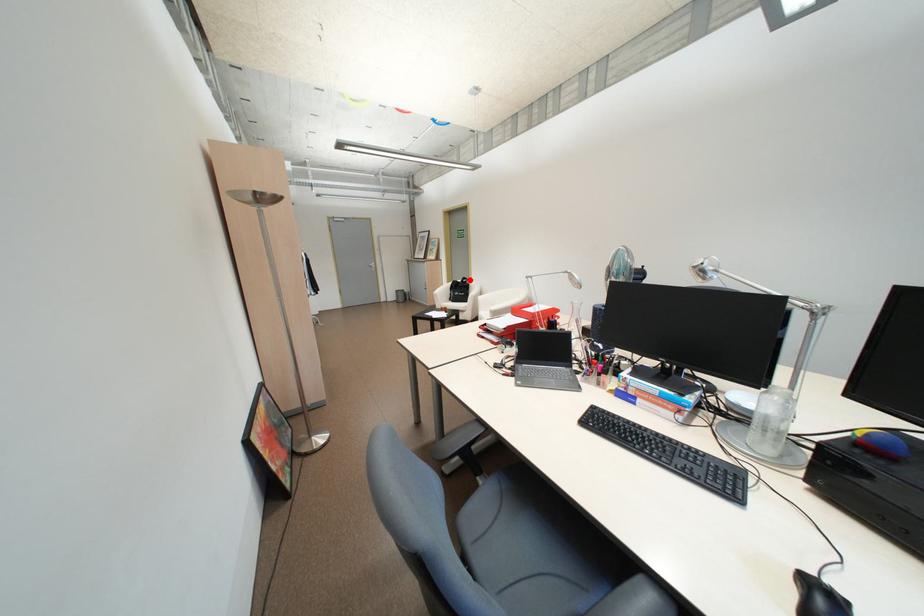
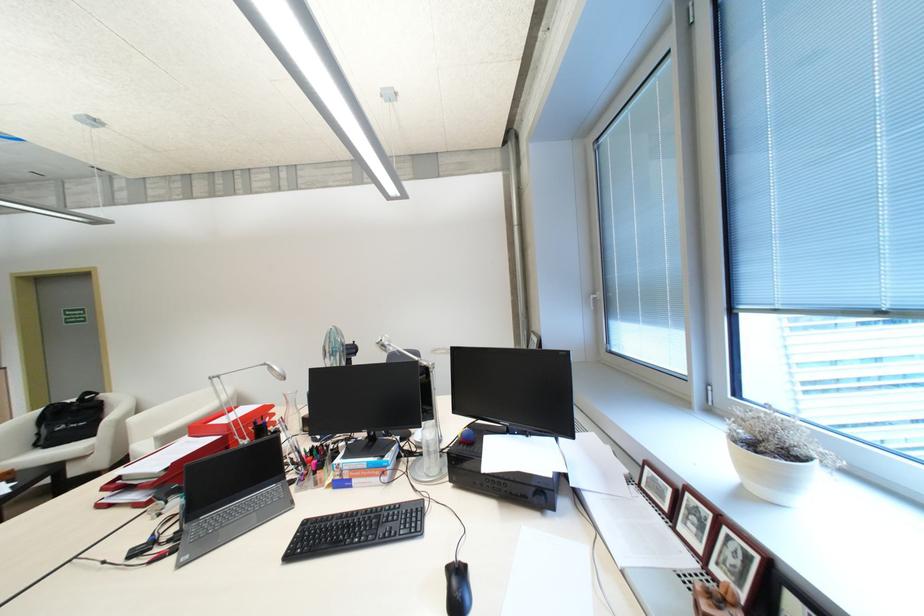
Question: I am providing you with two images of the same scene from different viewpoints. A red point is marked on the first image. At the location where the point appears in image 1, is it still visible in image 2?

Choices:
 (A) Yes
 (B) No

Answer: (A)